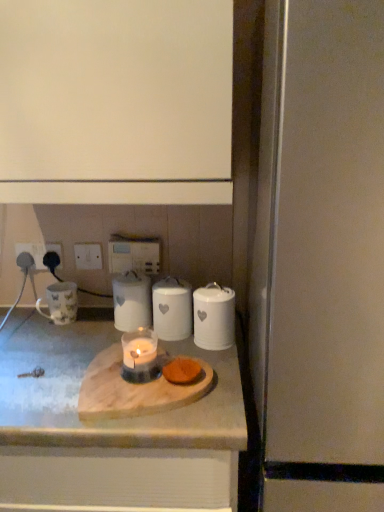
Identify the location of blank space to the left of translucent glass candle at center. This screenshot has height=512, width=384. (44, 379).